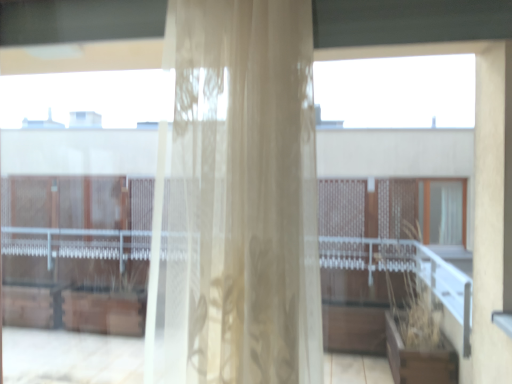
Question: Should I look upward or downward to see transparent glass window at upper right?

Choices:
 (A) down
 (B) up

Answer: (A)

Question: Is translucent floral-patterned curtain at center at the left side of transparent glass window at upper right?

Choices:
 (A) no
 (B) yes

Answer: (B)

Question: Can you confirm if translucent floral-patterned curtain at center is smaller than transparent glass window at upper right?

Choices:
 (A) yes
 (B) no

Answer: (B)

Question: Is translucent floral-patterned curtain at center in front of transparent glass window at upper right?

Choices:
 (A) yes
 (B) no

Answer: (A)

Question: From the image's perspective, is translucent floral-patterned curtain at center over transparent glass window at upper right?

Choices:
 (A) no
 (B) yes

Answer: (B)

Question: Is transparent glass window at upper right inside translucent floral-patterned curtain at center?

Choices:
 (A) yes
 (B) no

Answer: (B)

Question: From a real-world perspective, is translucent floral-patterned curtain at center on transparent glass window at upper right?

Choices:
 (A) yes
 (B) no

Answer: (A)

Question: Considering the relative positions of transparent glass window at upper right and translucent floral-patterned curtain at center in the image provided, is transparent glass window at upper right to the right of translucent floral-patterned curtain at center from the viewer's perspective?

Choices:
 (A) no
 (B) yes

Answer: (B)

Question: Is the position of transparent glass window at upper right less distant than that of translucent floral-patterned curtain at center?

Choices:
 (A) yes
 (B) no

Answer: (B)

Question: Does transparent glass window at upper right come behind translucent floral-patterned curtain at center?

Choices:
 (A) yes
 (B) no

Answer: (A)

Question: From a real-world perspective, is transparent glass window at upper right positioned under translucent floral-patterned curtain at center based on gravity?

Choices:
 (A) no
 (B) yes

Answer: (B)

Question: Is transparent glass window at upper right next to translucent floral-patterned curtain at center?

Choices:
 (A) yes
 (B) no

Answer: (B)

Question: From the image's perspective, is transparent glass window at upper right under translucent floral-patterned curtain at center?

Choices:
 (A) yes
 (B) no

Answer: (A)

Question: Is translucent floral-patterned curtain at center inside the boundaries of transparent glass window at upper right, or outside?

Choices:
 (A) inside
 (B) outside

Answer: (B)